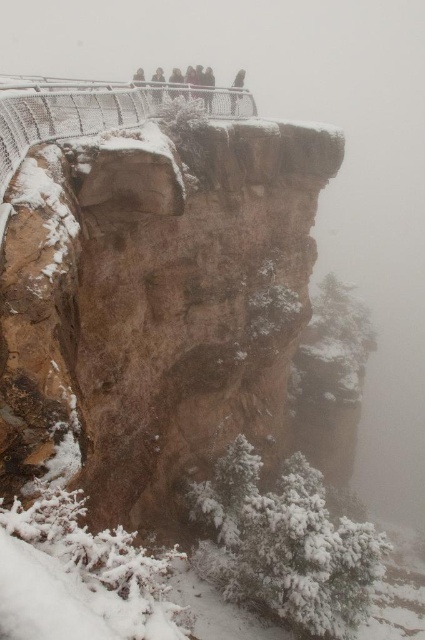
You are a park ranger at this cliffside viewpoint. You need to ensure visitors stay a safe distance from the edge. The safety guideline requires a minimum of 10 meters between the railing and any visitor. If the metal wire fence at upper center is the railing, and the dark gray stone figure at upper center represents a visitor, is the current distance compliant with the safety guideline?

The metal wire fence at upper center is 12.92 meters from the dark gray stone figure at upper center. Since the required minimum distance is 10 meters, the current distance of 12.92 meters meets the safety guideline.

You are a park ranger assessing safety measures at this cliffside viewpoint. The metal wire fence at upper center and the dark gray stone figure at upper center are both present. Which object is wider in terms of physical dimensions?

The metal wire fence at upper center is wider than the dark gray stone figure at upper center according to the description.